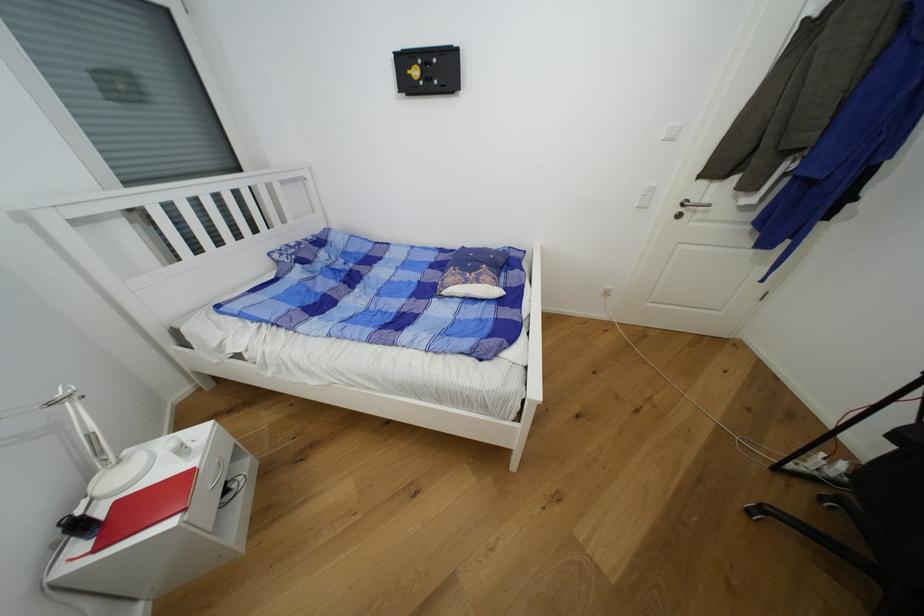
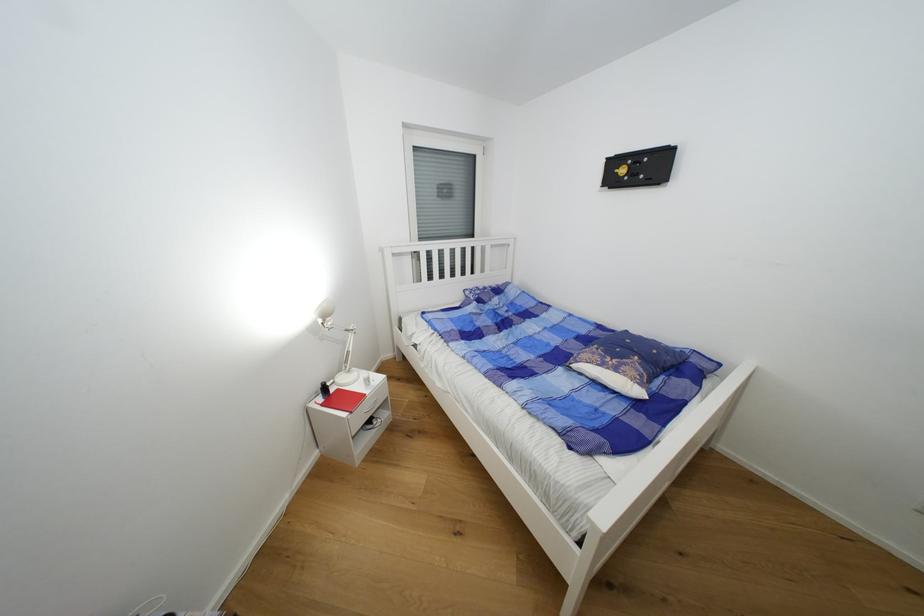
Find the pixel in the second image that matches point (482, 283) in the first image.

(622, 371)